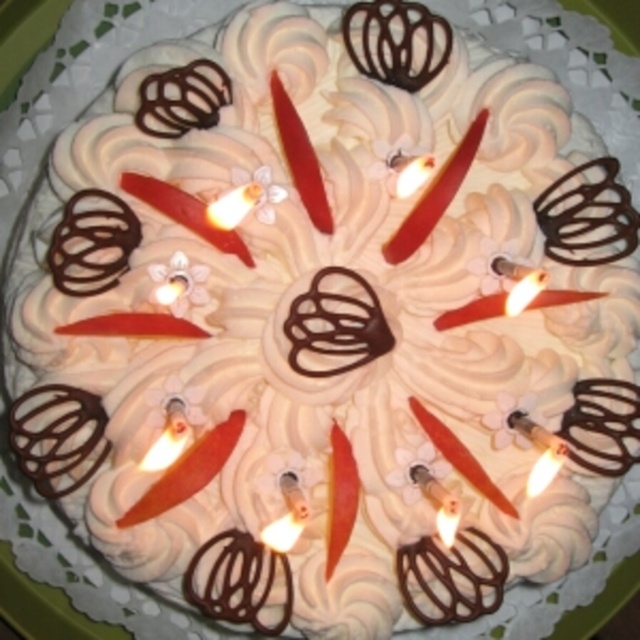
Does matte red candle at center have a lesser width compared to white wax candle at center?

Incorrect, matte red candle at center's width is not less than white wax candle at center's.

How distant is matte red candle at center from white wax candle at center?

They are 14.56 inches apart.

Is point (312, 211) farther from camera compared to point (561, 464)?

Yes, point (312, 211) is farther from viewer.

At what (x,y) coordinates should I click in order to perform the action: click on matte red candle at center. Please return your answer as a coordinate pair (x, y). Image resolution: width=640 pixels, height=640 pixels. Looking at the image, I should click on (300, 157).

Can you confirm if matte red candle at upper center is positioned above white wax candle at center?

Correct, matte red candle at upper center is located above white wax candle at center.

In the scene shown: Is matte red candle at upper center wider than white wax candle at center?

Yes, matte red candle at upper center is wider than white wax candle at center.

You are a GUI agent. You are given a task and a screenshot of the screen. Output one action in this format:
    pyautogui.click(x=<x>, y=<y>)
    Task: Click on the matte red candle at upper center
    This screenshot has width=640, height=640.
    Given the screenshot: What is the action you would take?
    pyautogui.click(x=435, y=195)

Is matte red candle at upper center positioned at the back of matte red candle at center?

That is True.

Which is in front, point (403, 243) or point (300, 180)?

Point (300, 180) is in front.

The width and height of the screenshot is (640, 640). Find the location of `matte red candle at upper center`. matte red candle at upper center is located at coordinates (435, 195).